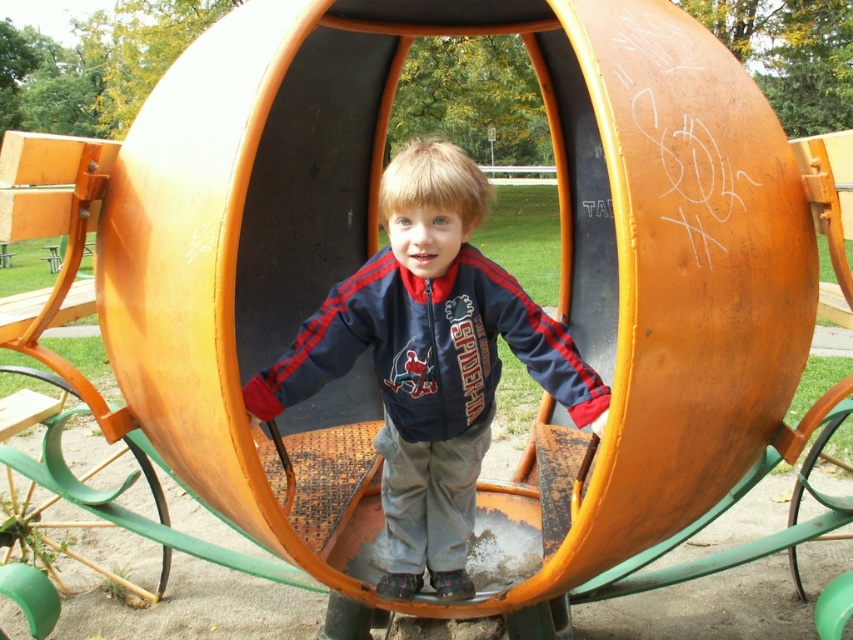
You are a parent trying to locate your child who is inside the large orange cylinder. You see the matte orange swing at center. Based on its position, can you estimate where in the cylinder your child might be standing?

The matte orange swing at center is located at point (430, 360), which is near the center of the cylinder. Therefore, your child is likely standing near the central area of the large orange cylinder.

You are a parent at the playground. Your child is wearing the navy blue fleece sweatshirt at center and is standing near the matte orange swing at center. You want to let them play on the swing. Since the sweatshirt might get caught, which item is narrower and less likely to get tangled?

The matte orange swing at center is thinner than the navy blue fleece sweatshirt at center, so the swing is narrower and less likely to get tangled.

You are a photographer trying to capture the entire playground structure in one shot. You notice two points marked on your camera screen at coordinates point (500, 369) and point (589, 401). Which point is closer to your camera lens?

Point (500, 369) is further to the camera than point (589, 401), so the point closer to the camera lens is point (589, 401).